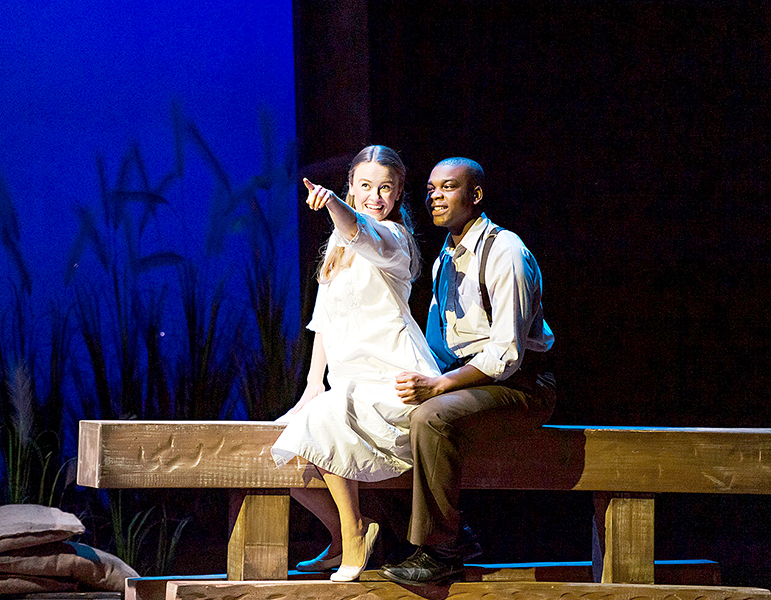
The image size is (771, 600). Identify the location of bench. pyautogui.click(x=231, y=458).